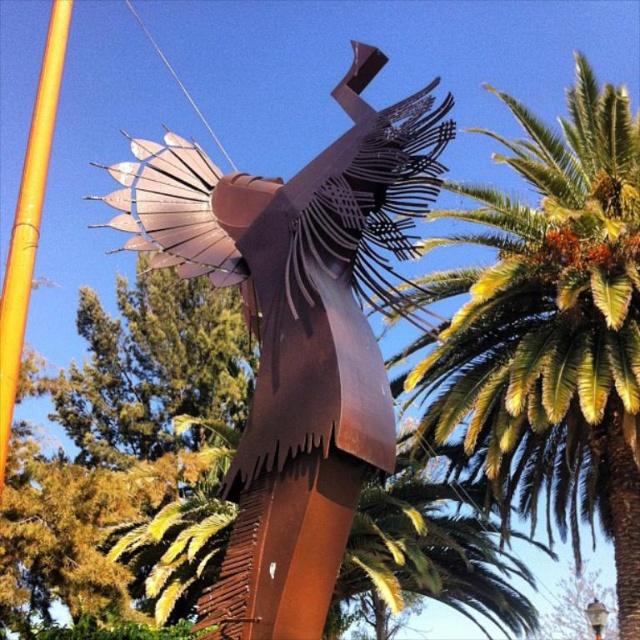
Question: Does green leafy palm tree at upper right have a lesser width compared to orange bamboo pole at left?

Choices:
 (A) no
 (B) yes

Answer: (A)

Question: Which object is positioned closest to the green leafy palm tree at upper right?

Choices:
 (A) orange bamboo pole at left
 (B) rusty metal sculpture at center

Answer: (A)

Question: Based on their relative distances, which object is nearer to the rusty metal sculpture at center?

Choices:
 (A) orange bamboo pole at left
 (B) green leafy palm tree at upper right

Answer: (A)

Question: Can you confirm if green leafy palm tree at upper right is positioned above orange bamboo pole at left?

Choices:
 (A) no
 (B) yes

Answer: (A)

Question: Can you confirm if rusty metal sculpture at center is smaller than green leafy palm tree at upper right?

Choices:
 (A) yes
 (B) no

Answer: (A)

Question: Which of these objects is positioned closest to the rusty metal sculpture at center?

Choices:
 (A) green leafy palm tree at upper right
 (B) orange bamboo pole at left

Answer: (B)